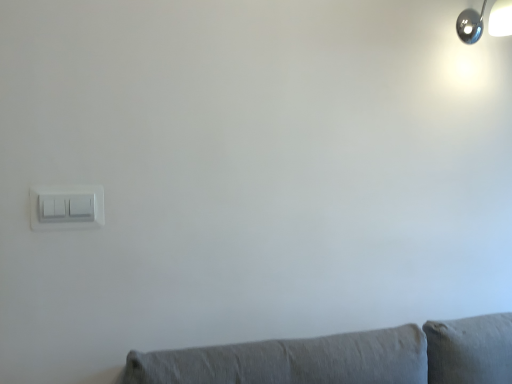
At what (x,y) coordinates should I click in order to perform the action: click on white plastic light switch at left. Please return your answer as a coordinate pair (x, y). Looking at the image, I should click on (66, 207).

The width and height of the screenshot is (512, 384). Describe the element at coordinates (66, 207) in the screenshot. I see `white plastic light switch at left` at that location.

Describe the element at coordinates (470, 25) in the screenshot. I see `polished chrome lamp at upper right` at that location.

Find the location of a particular element. The width and height of the screenshot is (512, 384). polished chrome lamp at upper right is located at coordinates (470, 25).

You are a GUI agent. You are given a task and a screenshot of the screen. Output one action in this format:
    pyautogui.click(x=<x>, y=<y>)
    Task: Click on the white plastic light switch at left
    
    Given the screenshot: What is the action you would take?
    pyautogui.click(x=66, y=207)

Between white plastic light switch at left and polished chrome lamp at upper right, which one appears on the left side from the viewer's perspective?

Positioned to the left is white plastic light switch at left.

Considering the positions of objects white plastic light switch at left and polished chrome lamp at upper right in the image provided, who is behind, white plastic light switch at left or polished chrome lamp at upper right?

polished chrome lamp at upper right.

Is point (56, 203) positioned before point (494, 32)?

Yes, it is in front of point (494, 32).

From the image's perspective, is white plastic light switch at left over polished chrome lamp at upper right?

No, from the image's perspective, white plastic light switch at left is not over polished chrome lamp at upper right.

From a real-world perspective, is white plastic light switch at left beneath polished chrome lamp at upper right?

Indeed, from a real-world perspective, white plastic light switch at left is positioned beneath polished chrome lamp at upper right.

Considering the relative sizes of white plastic light switch at left and polished chrome lamp at upper right in the image provided, is white plastic light switch at left wider than polished chrome lamp at upper right?

Incorrect, the width of white plastic light switch at left does not surpass that of polished chrome lamp at upper right.

Does white plastic light switch at left have a greater height compared to polished chrome lamp at upper right?

In fact, white plastic light switch at left may be shorter than polished chrome lamp at upper right.

Who is smaller, white plastic light switch at left or polished chrome lamp at upper right?

With smaller size is white plastic light switch at left.

Do you think white plastic light switch at left is within polished chrome lamp at upper right, or outside of it?

white plastic light switch at left is not enclosed by polished chrome lamp at upper right.

Are white plastic light switch at left and polished chrome lamp at upper right far apart?

Yes, white plastic light switch at left is far from polished chrome lamp at upper right.

From the picture: Is white plastic light switch at left looking in the opposite direction of polished chrome lamp at upper right?

No, white plastic light switch at left is not facing away from polished chrome lamp at upper right.

How different are the orientations of white plastic light switch at left and polished chrome lamp at upper right in degrees?

The angular difference between white plastic light switch at left and polished chrome lamp at upper right is 0.302 degrees.

This screenshot has height=384, width=512. I want to click on lamp above the white plastic light switch at left (from a real-world perspective), so click(470, 25).

Between polished chrome lamp at upper right and white plastic light switch at left, which one appears on the right side from the viewer's perspective?

Positioned to the right is polished chrome lamp at upper right.

Considering their positions, is polished chrome lamp at upper right located in front of or behind white plastic light switch at left?

polished chrome lamp at upper right is positioned farther from the viewer than white plastic light switch at left.

Which is farther, [495,15] or [102,205]?

The point [495,15] is behind.

From the image's perspective, would you say polished chrome lamp at upper right is shown under white plastic light switch at left?

No, from the image's perspective, polished chrome lamp at upper right is not below white plastic light switch at left.

From a real-world perspective, is polished chrome lamp at upper right above or below white plastic light switch at left?

In terms of real-world spatial position, polished chrome lamp at upper right is above white plastic light switch at left.

Can you confirm if polished chrome lamp at upper right is wider than white plastic light switch at left?

Indeed, polished chrome lamp at upper right has a greater width compared to white plastic light switch at left.

Considering the sizes of polished chrome lamp at upper right and white plastic light switch at left in the image, is polished chrome lamp at upper right taller or shorter than white plastic light switch at left?

Considering their sizes, polished chrome lamp at upper right has more height than white plastic light switch at left.

Between polished chrome lamp at upper right and white plastic light switch at left, which one has smaller size?

Smaller between the two is white plastic light switch at left.

Is white plastic light switch at left completely or partially inside polished chrome lamp at upper right?

No, polished chrome lamp at upper right does not contain white plastic light switch at left.

Is polished chrome lamp at upper right next to white plastic light switch at left and touching it?

They are not placed beside each other.

Consider the image. Could you tell me if polished chrome lamp at upper right is facing white plastic light switch at left?

No.

What's the angular difference between polished chrome lamp at upper right and white plastic light switch at left's facing directions?

0.302 degrees separate the facing orientations of polished chrome lamp at upper right and white plastic light switch at left.

How much distance is there between polished chrome lamp at upper right and white plastic light switch at left?

polished chrome lamp at upper right and white plastic light switch at left are 1.50 meters apart.

Where is `lamp that is above the white plastic light switch at left (from a real-world perspective)`? This screenshot has width=512, height=384. lamp that is above the white plastic light switch at left (from a real-world perspective) is located at coordinates (470, 25).

The image size is (512, 384). I want to click on lamp behind the white plastic light switch at left, so click(x=470, y=25).

In order to click on lamp that appears above the white plastic light switch at left (from the image's perspective) in this screenshot , I will do `click(470, 25)`.